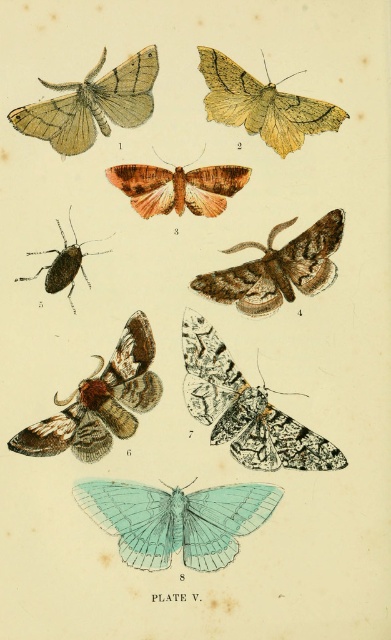
Question: Is black and white speckled moth at center above yellowish-brown textured moth at upper center?

Choices:
 (A) no
 (B) yes

Answer: (A)

Question: Observing the image, what is the correct spatial positioning of brown fuzzy moth at lower left in reference to matte brown moth at upper left?

Choices:
 (A) above
 (B) below

Answer: (B)

Question: Based on their relative distances, which object is farther from the matte brown moth at upper left?

Choices:
 (A) black and white speckled moth at center
 (B) yellowish-brown textured moth at upper center
 (C) brown textured moth at center
 (D) translucent teal moth at bottom

Answer: (D)

Question: Which point appears closest to the camera in this image?

Choices:
 (A) (98, 96)
 (B) (10, 445)

Answer: (A)

Question: Can you confirm if black and white speckled moth at center is smaller than yellowish-brown textured moth at upper center?

Choices:
 (A) no
 (B) yes

Answer: (A)

Question: Which object is positioned closest to the matte black bug at left?

Choices:
 (A) matte brown moth at upper left
 (B) translucent teal moth at center
 (C) brown textured moth at center

Answer: (C)